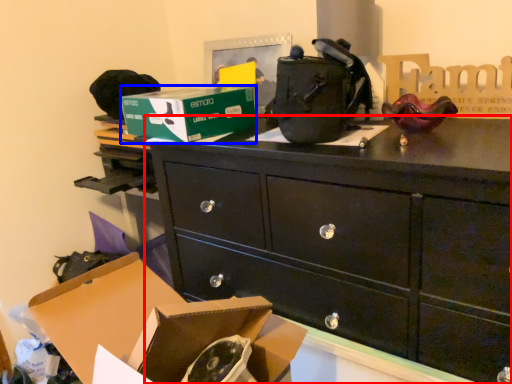
Question: Which object appears farthest to the camera in this image, chest of drawers (highlighted by a red box) or box (highlighted by a blue box)?

Choices:
 (A) chest of drawers
 (B) box

Answer: (B)